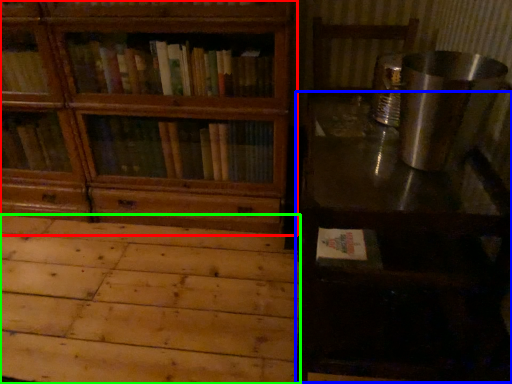
Question: Based on their relative distances, which object is farther from bookcase (highlighted by a red box)? Choose from table (highlighted by a blue box) and plywood (highlighted by a green box).

Choices:
 (A) table
 (B) plywood

Answer: (A)